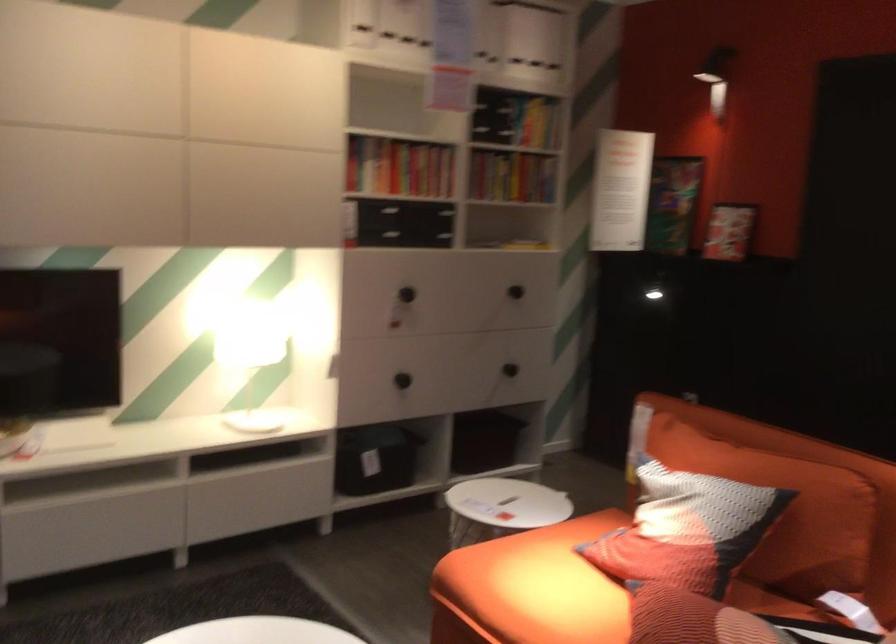
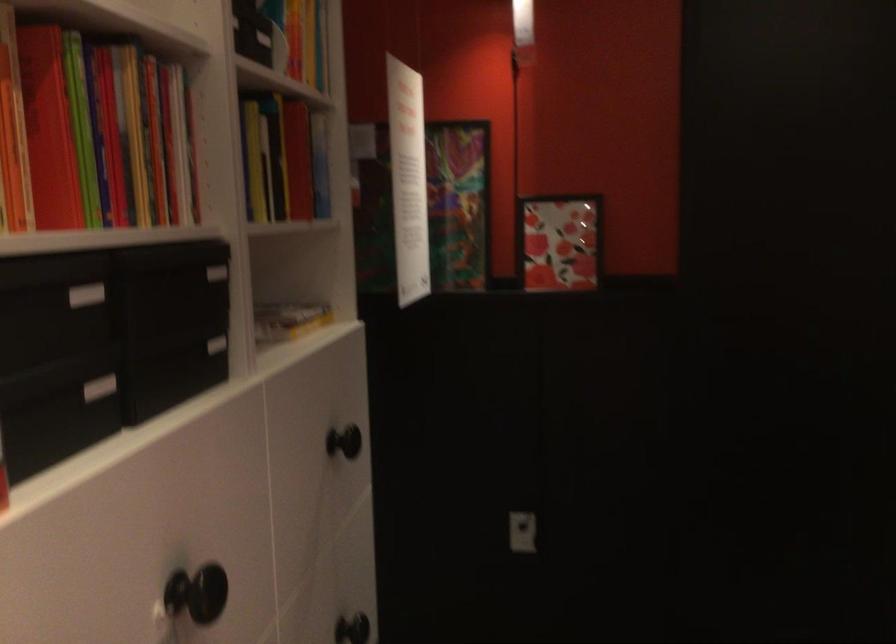
In the second image, find the point that corresponds to the point at 399,193 in the first image.

(85, 295)